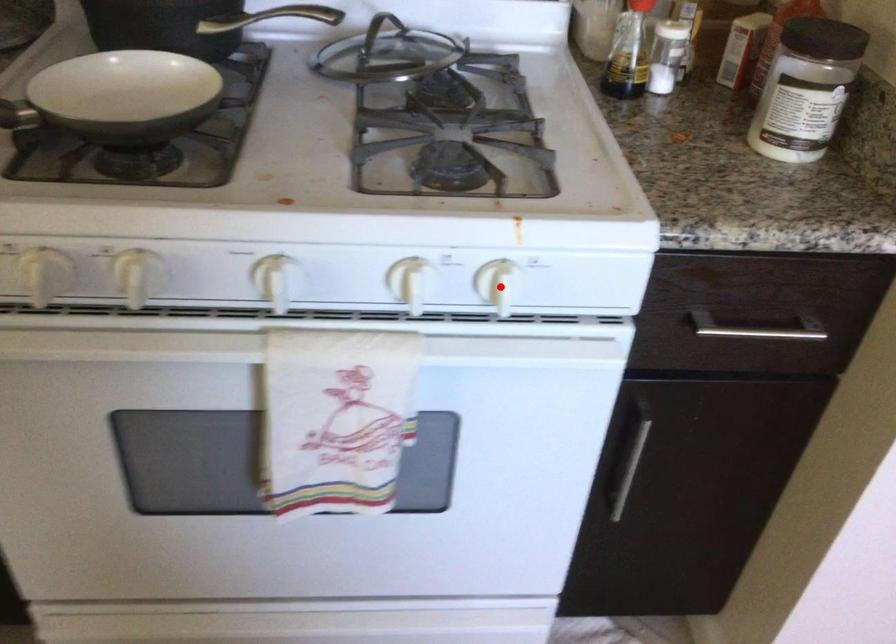
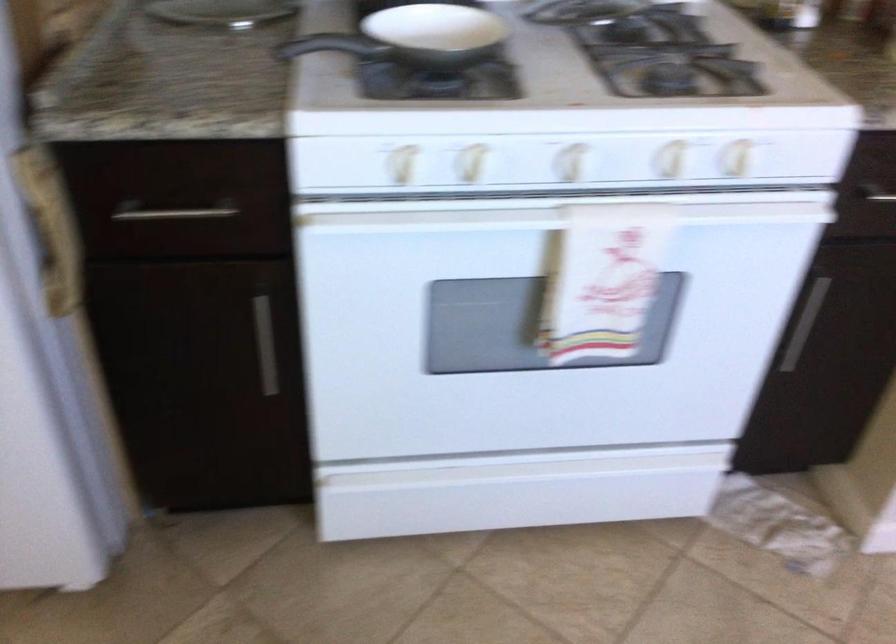
Locate, in the second image, the point that corresponds to the highlighted location in the first image.

(737, 158)